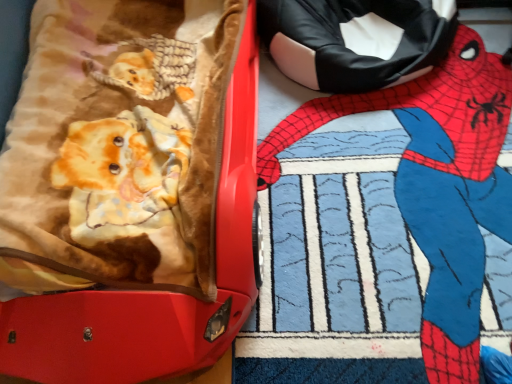
In order to face spider-man costume at upper right, should I rotate leftwards or rightwards?

Turn right approximately 19.569 degrees to face it.

Image resolution: width=512 pixels, height=384 pixels. In order to click on spider-man costume at upper right in this screenshot , I will do `click(437, 182)`.

The width and height of the screenshot is (512, 384). What do you see at coordinates (437, 182) in the screenshot?
I see `spider-man costume at upper right` at bounding box center [437, 182].

This screenshot has width=512, height=384. What do you see at coordinates (129, 190) in the screenshot?
I see `matte red suitcase at left` at bounding box center [129, 190].

The image size is (512, 384). I want to click on matte red suitcase at left, so click(129, 190).

The height and width of the screenshot is (384, 512). What are the coordinates of `spider-man costume at upper right` in the screenshot? It's located at (437, 182).

Does spider-man costume at upper right appear on the left side of matte red suitcase at left?

In fact, spider-man costume at upper right is to the right of matte red suitcase at left.

Does spider-man costume at upper right lie in front of matte red suitcase at left?

No, the depth of spider-man costume at upper right is greater than that of matte red suitcase at left.

Which is farther from the camera, (262, 156) or (61, 341)?

The point (262, 156) is farther.

From the image's perspective, which is above, spider-man costume at upper right or matte red suitcase at left?

matte red suitcase at left.

From a real-world perspective, who is located lower, spider-man costume at upper right or matte red suitcase at left?

spider-man costume at upper right is physically lower.

Considering the sizes of objects spider-man costume at upper right and matte red suitcase at left in the image provided, who is thinner, spider-man costume at upper right or matte red suitcase at left?

spider-man costume at upper right.

Considering the sizes of objects spider-man costume at upper right and matte red suitcase at left in the image provided, who is shorter, spider-man costume at upper right or matte red suitcase at left?

spider-man costume at upper right is shorter.

Who is bigger, spider-man costume at upper right or matte red suitcase at left?

matte red suitcase at left is bigger.

Would you say spider-man costume at upper right is outside matte red suitcase at left?

spider-man costume at upper right lies outside matte red suitcase at left's area.

Is spider-man costume at upper right next to matte red suitcase at left and touching it?

No, spider-man costume at upper right is not next to matte red suitcase at left.

Is spider-man costume at upper right looking in the opposite direction of matte red suitcase at left?

No, spider-man costume at upper right's orientation is not away from matte red suitcase at left.

Find the location of a particular element. The width and height of the screenshot is (512, 384). person below the matte red suitcase at left (from a real-world perspective) is located at coordinates (437, 182).

Visually, is matte red suitcase at left positioned to the left or to the right of spider-man costume at upper right?

From the image, it's evident that matte red suitcase at left is to the left of spider-man costume at upper right.

Is matte red suitcase at left in front of or behind spider-man costume at upper right in the image?

matte red suitcase at left is positioned closer to the viewer than spider-man costume at upper right.

Which point is more distant from viewer, (137, 279) or (459, 127)?

The point (459, 127) is more distant.

Based on the photo, from the image's perspective, between matte red suitcase at left and spider-man costume at upper right, who is located below?

spider-man costume at upper right, from the image's perspective.

From a real-world perspective, who is located lower, matte red suitcase at left or spider-man costume at upper right?

spider-man costume at upper right is physically lower.

Considering the relative sizes of matte red suitcase at left and spider-man costume at upper right in the image provided, is matte red suitcase at left wider than spider-man costume at upper right?

Correct, the width of matte red suitcase at left exceeds that of spider-man costume at upper right.

Who is taller, matte red suitcase at left or spider-man costume at upper right?

matte red suitcase at left is taller.

Is matte red suitcase at left bigger than spider-man costume at upper right?

Correct, matte red suitcase at left is larger in size than spider-man costume at upper right.

Does matte red suitcase at left contain spider-man costume at upper right?

No, spider-man costume at upper right is not surrounded by matte red suitcase at left.

Is the surface of matte red suitcase at left in direct contact with spider-man costume at upper right?

No.

Is matte red suitcase at left oriented towards spider-man costume at upper right?

No, matte red suitcase at left is not turned towards spider-man costume at upper right.

Can you tell me how much matte red suitcase at left and spider-man costume at upper right differ in facing direction?

matte red suitcase at left and spider-man costume at upper right are facing 2.54e-05 degrees away from each other.

Locate an element on the screen. This screenshot has width=512, height=384. person behind the matte red suitcase at left is located at coordinates (437, 182).

There is a spider-man costume at upper right. What are the coordinates of `suitcase above it (from a real-world perspective)` in the screenshot? It's located at (129, 190).

In the image, there is a matte red suitcase at left. Where is `person below it (from the image's perspective)`? Image resolution: width=512 pixels, height=384 pixels. person below it (from the image's perspective) is located at coordinates (437, 182).